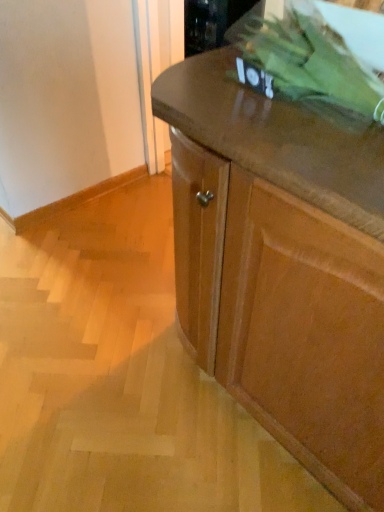
Question: Should I look upward or downward to see wooden cabinet at center?

Choices:
 (A) up
 (B) down

Answer: (B)